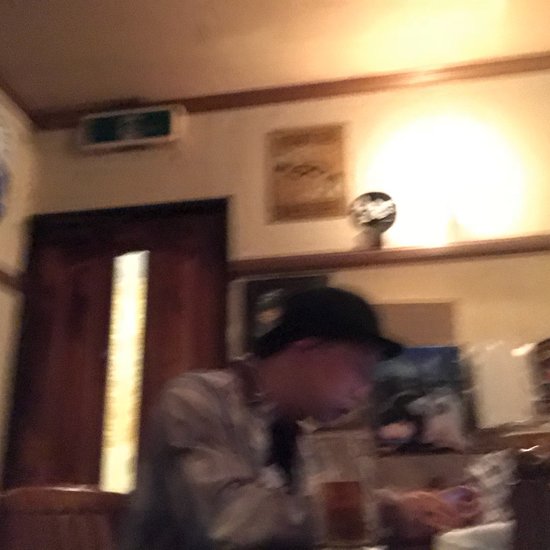
At what (x,y) coordinates should I click in order to perform the action: click on door. Please return your answer as a coordinate pair (x, y). Looking at the image, I should click on (111, 223).